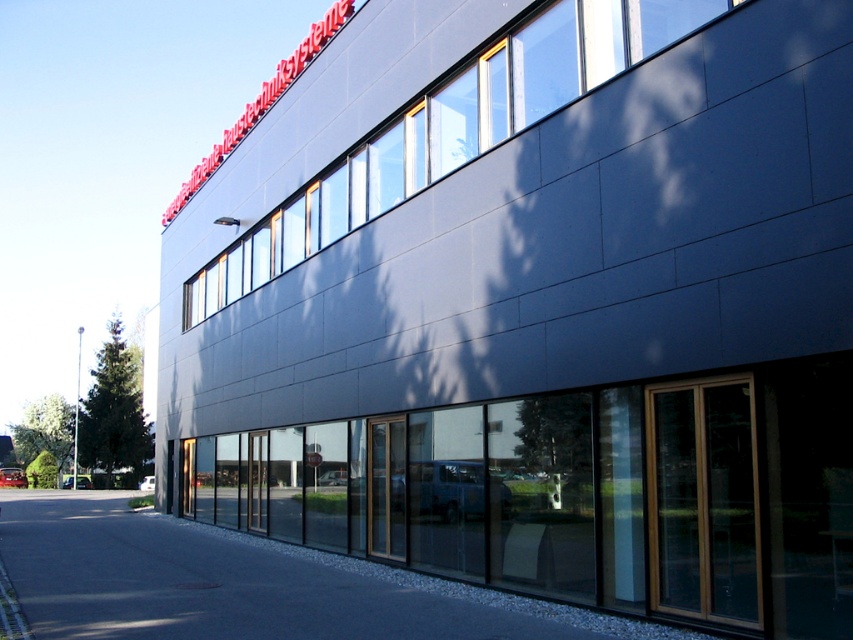
Question: Can you confirm if gray asphalt pavement at lower center is positioned to the left of slate gray glass windows at upper center?

Choices:
 (A) no
 (B) yes

Answer: (B)

Question: Which point is farther to the camera?

Choices:
 (A) (323, 184)
 (B) (323, 557)

Answer: (A)

Question: Does gray asphalt pavement at lower center lie in front of slate gray glass windows at upper center?

Choices:
 (A) yes
 (B) no

Answer: (A)

Question: In this image, where is gray asphalt pavement at lower center located relative to slate gray glass windows at upper center?

Choices:
 (A) right
 (B) left

Answer: (B)

Question: Which object is farther from the camera taking this photo?

Choices:
 (A) slate gray glass windows at upper center
 (B) gray asphalt pavement at lower center

Answer: (A)